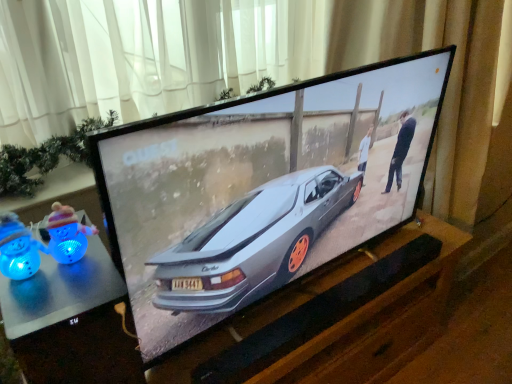
Where is `free spot in front of blue plastic toy at lower left, which is counted as the second toy, starting from the right`? Image resolution: width=512 pixels, height=384 pixels. free spot in front of blue plastic toy at lower left, which is counted as the second toy, starting from the right is located at coordinates (31, 313).